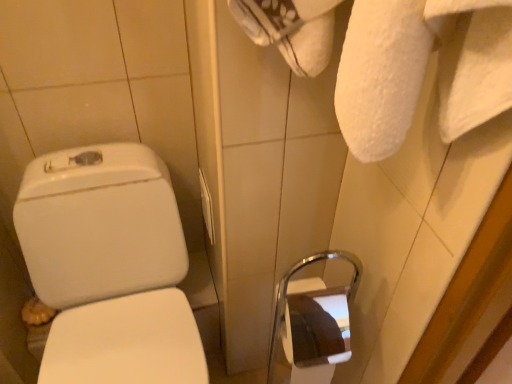
Question: Should I look upward or downward to see white plastic towel bar at center?

Choices:
 (A) down
 (B) up

Answer: (A)

Question: Considering the relative positions of white plastic towel bar at center and white glossy toilet at left in the image provided, is white plastic towel bar at center to the left of white glossy toilet at left from the viewer's perspective?

Choices:
 (A) no
 (B) yes

Answer: (A)

Question: Considering the relative sizes of white plastic towel bar at center and white glossy toilet at left in the image provided, is white plastic towel bar at center bigger than white glossy toilet at left?

Choices:
 (A) yes
 (B) no

Answer: (B)

Question: Is white plastic towel bar at center positioned beyond the bounds of white glossy toilet at left?

Choices:
 (A) yes
 (B) no

Answer: (A)

Question: Is white plastic towel bar at center next to white glossy toilet at left and touching it?

Choices:
 (A) yes
 (B) no

Answer: (B)

Question: Is white glossy toilet at left located within white plastic towel bar at center?

Choices:
 (A) no
 (B) yes

Answer: (A)

Question: From the image's perspective, is white plastic towel bar at center located beneath white glossy toilet at left?

Choices:
 (A) yes
 (B) no

Answer: (B)

Question: Considering the relative sizes of white glossy toilet at left and white plastic towel bar at center in the image provided, is white glossy toilet at left shorter than white plastic towel bar at center?

Choices:
 (A) yes
 (B) no

Answer: (B)

Question: Is white plastic towel bar at center surrounded by white glossy toilet at left?

Choices:
 (A) no
 (B) yes

Answer: (A)

Question: From a real-world perspective, is white glossy toilet at left below white plastic towel bar at center?

Choices:
 (A) yes
 (B) no

Answer: (A)

Question: Is there a large distance between white glossy toilet at left and white plastic towel bar at center?

Choices:
 (A) yes
 (B) no

Answer: (B)

Question: Is white glossy toilet at left at the left side of white plastic towel bar at center?

Choices:
 (A) yes
 (B) no

Answer: (A)

Question: Considering the relative sizes of white glossy toilet at left and white plastic towel bar at center in the image provided, is white glossy toilet at left wider than white plastic towel bar at center?

Choices:
 (A) no
 (B) yes

Answer: (B)

Question: Considering their positions, is white glossy toilet at left located in front of or behind white plastic towel bar at center?

Choices:
 (A) behind
 (B) front

Answer: (B)